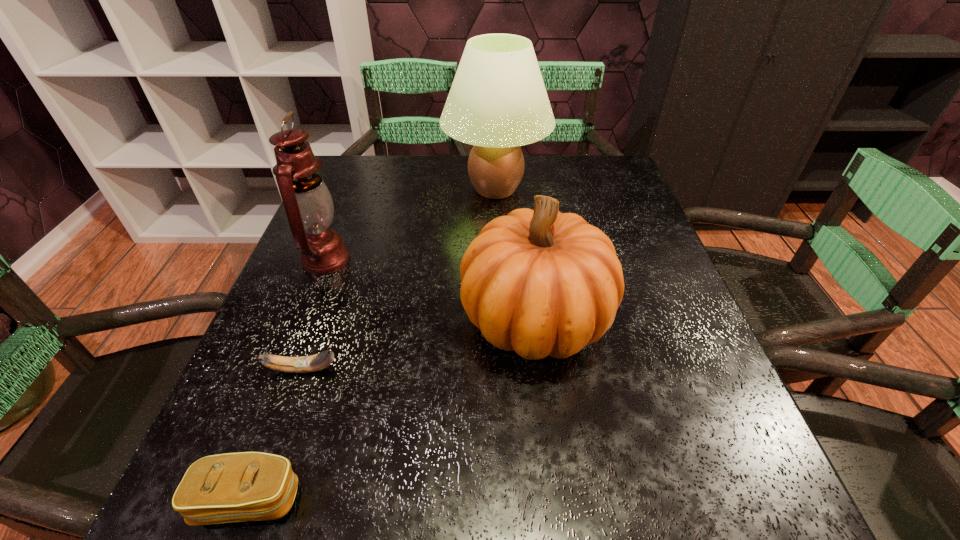
At what (x,y) coordinates should I click in order to perform the action: click on free spot between the clutch bag and the banana. Please return your answer as a coordinate pair (x, y). Looking at the image, I should click on (276, 434).

Identify the location of free space between the farthest object and the banana. (399, 279).

You are a GUI agent. You are given a task and a screenshot of the screen. Output one action in this format:
    pyautogui.click(x=<x>, y=<y>)
    Task: Click on the vacant space that's between the banana and the pumpkin
    The width and height of the screenshot is (960, 540).
    Given the screenshot: What is the action you would take?
    pyautogui.click(x=419, y=344)

Find the location of a particular element. The image size is (960, 540). free space that is in between the pumpkin and the oil lamp is located at coordinates (431, 289).

Identify which object is the third closest to the oil lamp. Please provide its 2D coordinates. Your answer should be formatted as a tuple, i.e. [(x, y)], where the tuple contains the x and y coordinates of a point satisfying the conditions above.

[(539, 282)]

At what (x,y) coordinates should I click in order to perform the action: click on object that stands as the third closest to the third tallest object. Please return your answer as a coordinate pair (x, y). The width and height of the screenshot is (960, 540). Looking at the image, I should click on (308, 204).

This screenshot has height=540, width=960. Identify the location of vacant space that satisfies the following two spatial constraints: 1. on the front side of the pumpkin; 2. at the stem of the banana. (541, 369).

Where is `free spot that satisfies the following two spatial constraints: 1. at the stem of the banana; 2. on the zipper side of the clutch bag`? free spot that satisfies the following two spatial constraints: 1. at the stem of the banana; 2. on the zipper side of the clutch bag is located at coordinates [x=257, y=500].